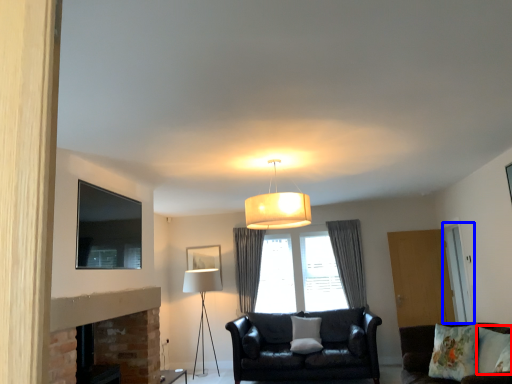
Question: Which object is further to the camera taking this photo, pillow (highlighted by a red box) or glass door (highlighted by a blue box)?

Choices:
 (A) pillow
 (B) glass door

Answer: (B)